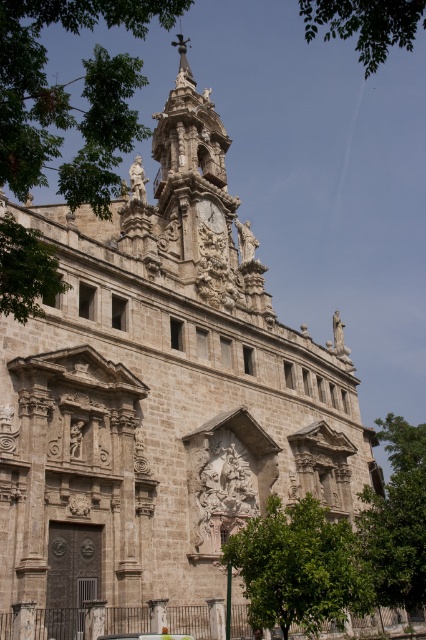
Consider the image. You are standing in front of the historic building and want to take a photo of both the green leafy tree at left and the metallic car at lower center. Which object should you focus on first to ensure both are in the frame?

You should focus on the green leafy tree at left first because it is closer to the viewer than the metallic car at lower center, so adjusting the camera to include both would require ensuring the closer object is framed properly first.

You are standing in front of the historic building and want to take a photo of the tower with the clock face. Considering the green leafy tree at lower center and the metallic car at lower center, which object might block your view of the tower?

The green leafy tree at lower center is bigger than the metallic car at lower center, so it might block your view of the tower more than the metallic car at lower center.

You are standing in front of the historic building and want to take a photo that includes both the green leafy tree at lower right and the golden stone clock at center. Which object will appear larger in the photo?

The green leafy tree at lower right will appear larger in the photo because it is bigger than the golden stone clock at center.